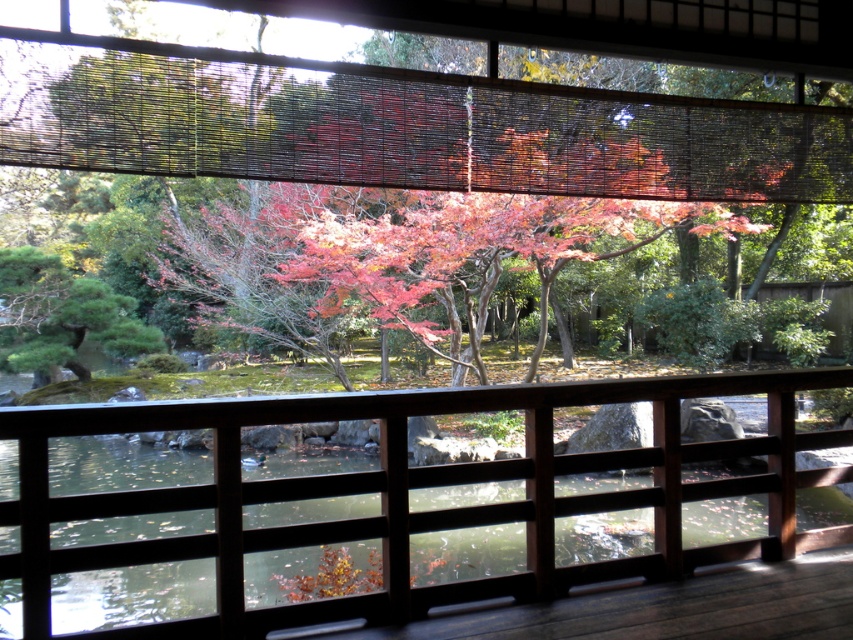
Question: Is the position of autumn leaves at center less distant than that of brown wooden rail at center?

Choices:
 (A) no
 (B) yes

Answer: (B)

Question: Which of the following is the closest to the observer?

Choices:
 (A) autumn leaves at center
 (B) brown wooden rail at center

Answer: (A)

Question: Can you confirm if autumn leaves at center is positioned above brown wooden rail at center?

Choices:
 (A) yes
 (B) no

Answer: (A)

Question: From the image, what is the correct spatial relationship of autumn leaves at center in relation to brown wooden rail at center?

Choices:
 (A) right
 (B) left

Answer: (B)